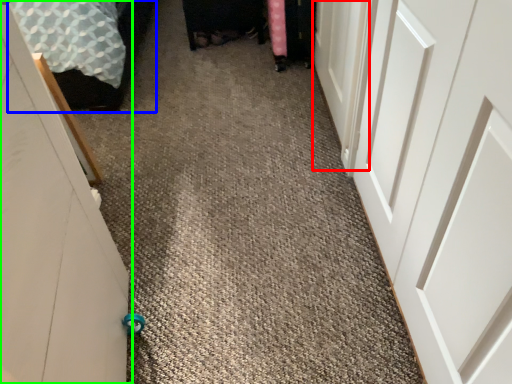
Question: Which object is the closest to the door (highlighted by a red box)? Choose among these: bed (highlighted by a blue box) or door (highlighted by a green box).

Choices:
 (A) bed
 (B) door

Answer: (B)